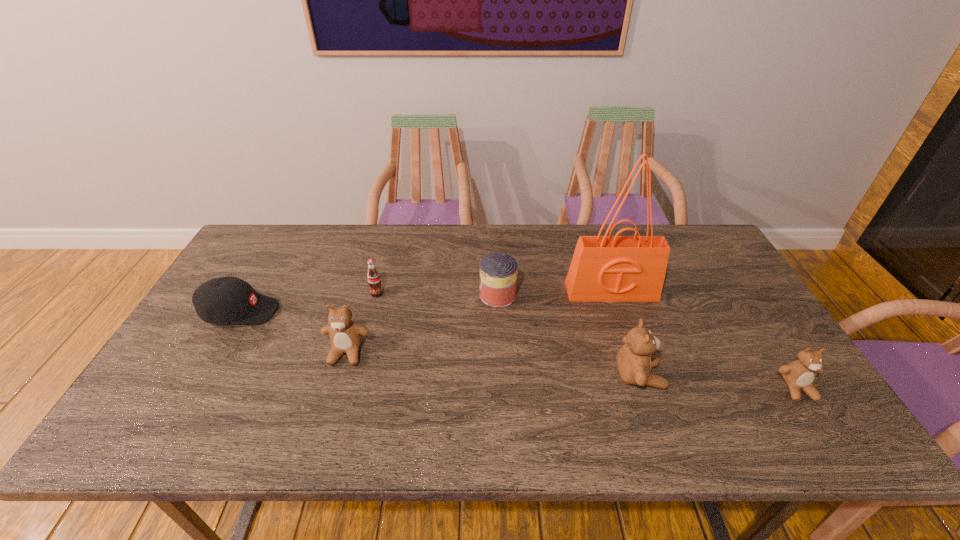
To achieve uniform spacing by inserting another teddy_bear among them, please point to a free space for this new teddy_bear. Please provide its 2D coordinates. Your answer should be formatted as a tuple, i.e. [(x, y)], where the tuple contains the x and y coordinates of a point satisfying the conditions above.

[(490, 364)]